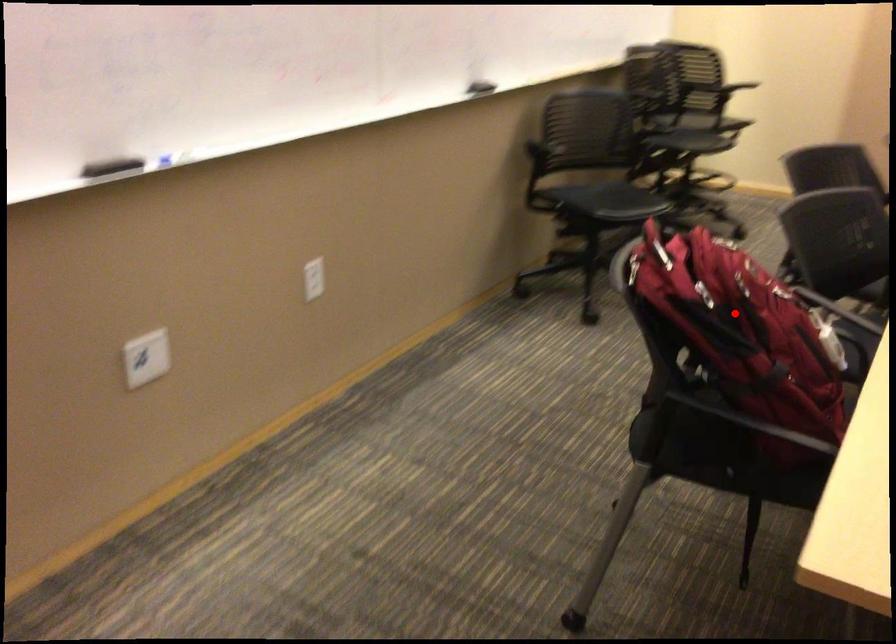
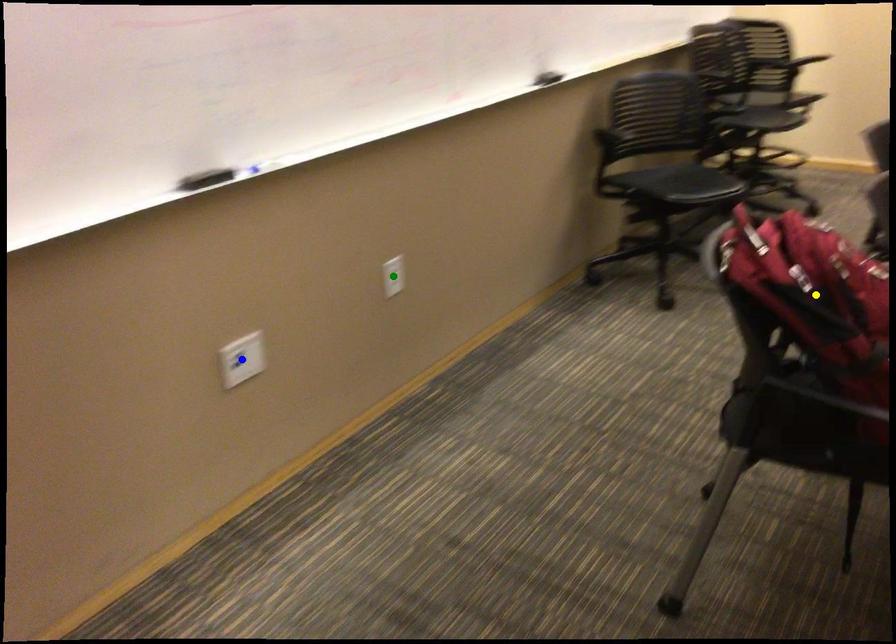
Question: I am providing you with two images of the same scene from different viewpoints. A red point is marked on the first image. You are given multiple points on the second image. Which point in image 2 is actually the same real-world point as the red point in image 1?

Choices:
 (A) green point
 (B) yellow point
 (C) blue point

Answer: (B)